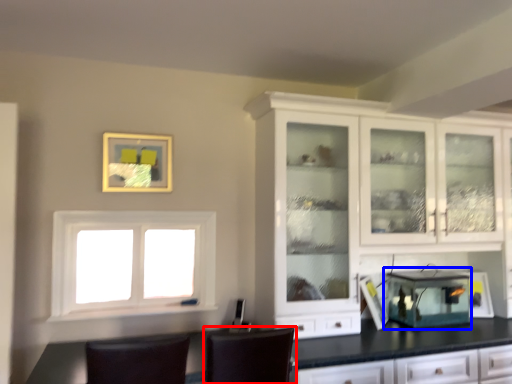
Question: Which of the following is the farthest to the observer, chair (highlighted by a red box) or appliance (highlighted by a blue box)?

Choices:
 (A) chair
 (B) appliance

Answer: (B)